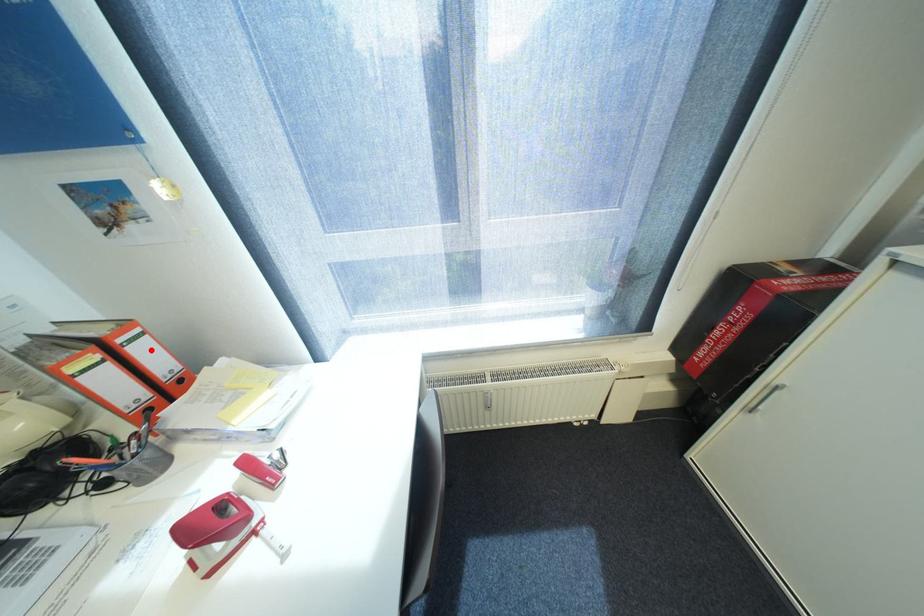
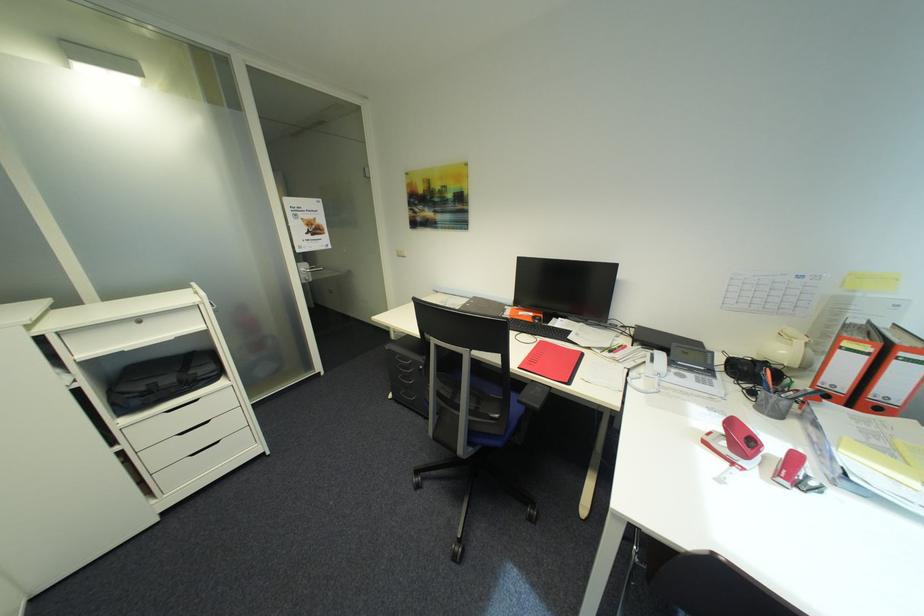
Where in the second image is the point corresponding to the highlighted location from the first image?

(912, 371)